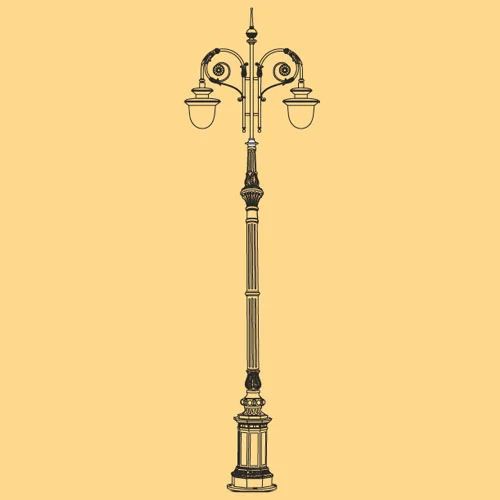
Where is `roundeddark section towards the top of the lamp`? roundeddark section towards the top of the lamp is located at coordinates (249, 196).